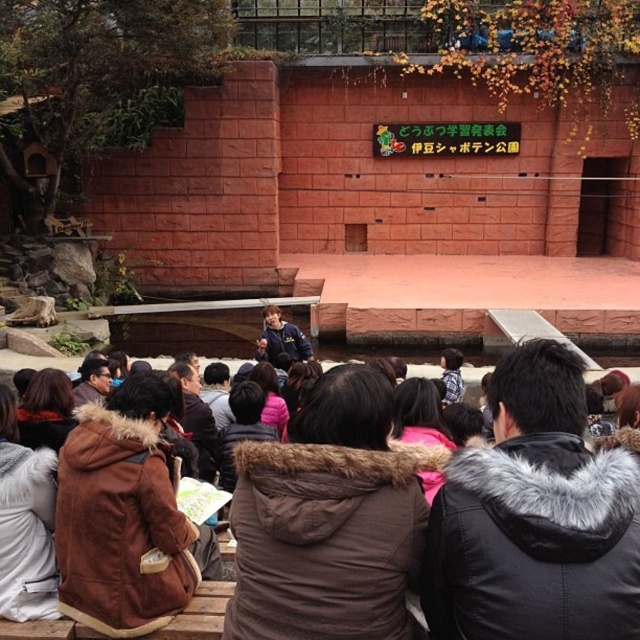
Question: Is black fur-lined jacket at lower right in front of brown fur-lined coat at center?

Choices:
 (A) yes
 (B) no

Answer: (B)

Question: Which object is farther from the camera taking this photo?

Choices:
 (A) brown fur-lined coat at center
 (B) black fur-lined jacket at lower right

Answer: (B)

Question: Is black fur-lined jacket at lower right above brown fur-lined coat at center?

Choices:
 (A) no
 (B) yes

Answer: (B)

Question: Which point is farther to the camera?

Choices:
 (A) black fur-lined jacket at lower right
 (B) brown fur-lined coat at center

Answer: (A)

Question: Considering the relative positions of black fur-lined jacket at lower right and brown fur-lined coat at center in the image provided, where is black fur-lined jacket at lower right located with respect to brown fur-lined coat at center?

Choices:
 (A) above
 (B) below

Answer: (A)